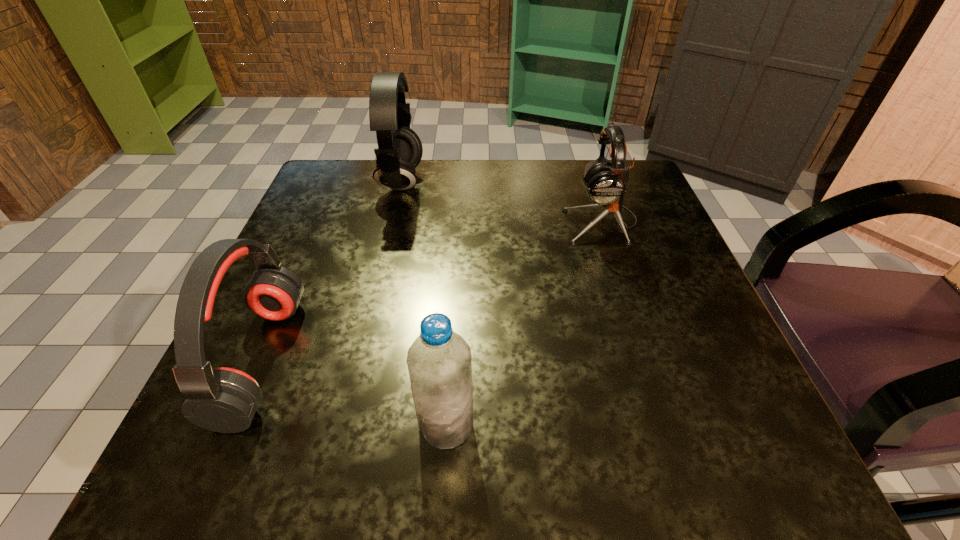
Locate an element on the screen. The image size is (960, 540). the second earphone from right to left is located at coordinates (399, 152).

Locate an element on the screen. the rightmost earphone is located at coordinates (606, 183).

Identify the location of water bottle. Image resolution: width=960 pixels, height=540 pixels. (439, 362).

The image size is (960, 540). In order to click on the leftmost earphone in this screenshot , I will do `click(224, 400)`.

Locate an element on the screen. The height and width of the screenshot is (540, 960). the nearest earphone is located at coordinates (224, 400).

Where is `vacant space situated on the ear cups of the third object from right to left`? Image resolution: width=960 pixels, height=540 pixels. vacant space situated on the ear cups of the third object from right to left is located at coordinates [x=556, y=183].

Identify the location of free location located on the left of the rightmost object. The image size is (960, 540). (455, 222).

Identify the location of free spot located 0.090m on the back of the water bottle. (451, 347).

Identify the location of blank space located on the ear cups of the leftmost object. This screenshot has height=540, width=960. (520, 360).

I want to click on water bottle at the near edge, so click(439, 362).